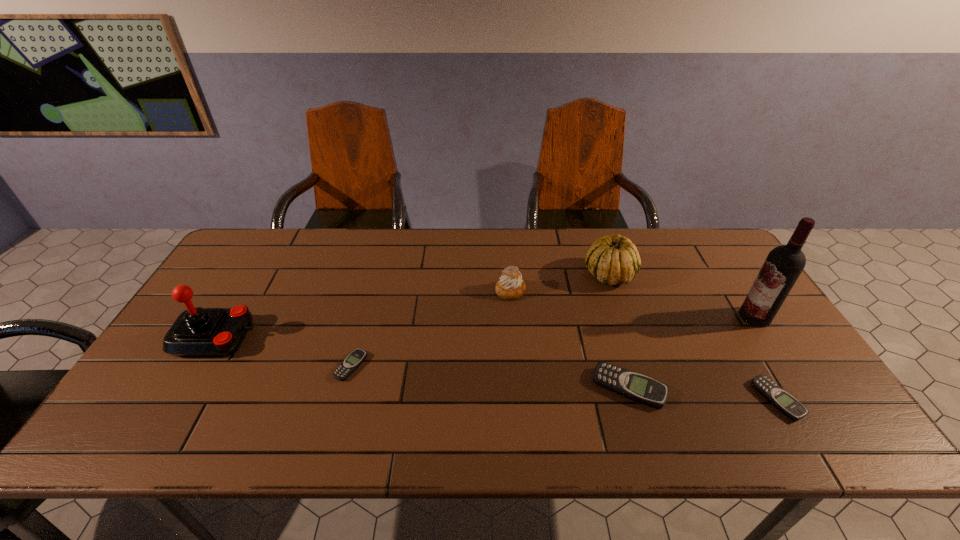
This screenshot has height=540, width=960. Identify the location of the leftmost beeper. (355, 358).

The width and height of the screenshot is (960, 540). In order to click on the shortest beeper in this screenshot , I will do `click(355, 358)`.

Identify the location of the second beeper from right to left. The image size is (960, 540). (637, 387).

I want to click on the third shortest object, so coord(637,387).

Find the location of `the rightmost beeper`. the rightmost beeper is located at coordinates (778, 397).

Identify the location of the second shortest beeper. This screenshot has width=960, height=540. (778, 397).

Identify the location of the third tallest object. This screenshot has height=540, width=960. (614, 260).

Locate an element on the screen. The height and width of the screenshot is (540, 960). the tallest object is located at coordinates 784,264.

This screenshot has height=540, width=960. Identify the location of the fourth shortest object. (511, 286).

This screenshot has height=540, width=960. Find the location of `the third object from left to right`. the third object from left to right is located at coordinates (511, 286).